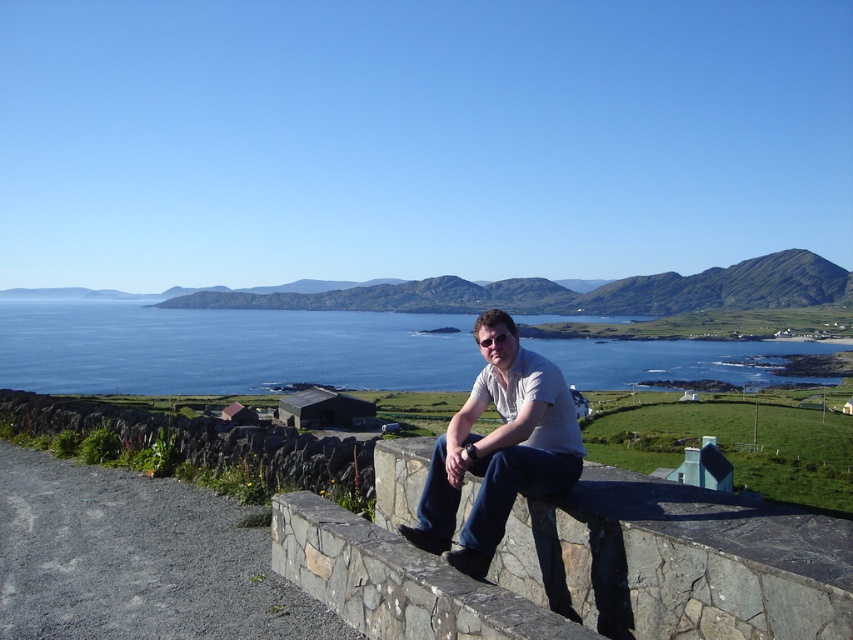
Between blue water at center and white cotton shirt at center, which one has more height?

Standing taller between the two is blue water at center.

Who is more distant from viewer, (595, 344) or (519, 477)?

The point (595, 344) is behind.

Measure the distance between point (389, 380) and camera.

108.57 meters

The height and width of the screenshot is (640, 853). In order to click on blue water at center in this screenshot , I will do `click(225, 348)`.